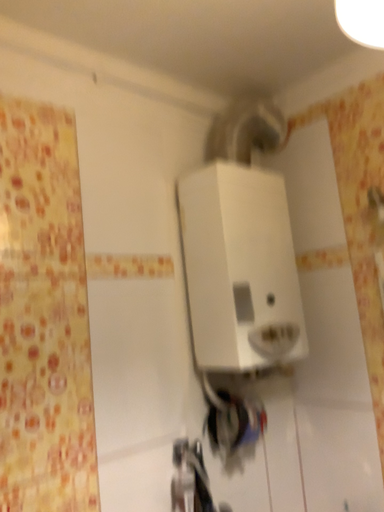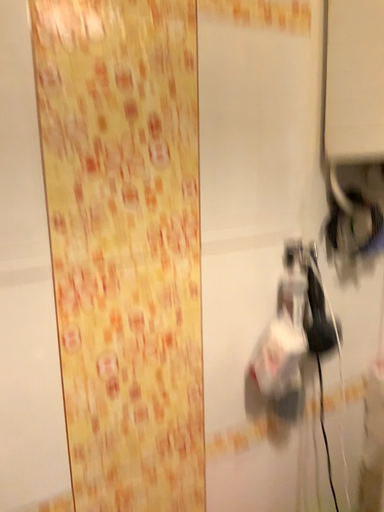
Question: Which way did the camera rotate in the video?

Choices:
 (A) rotated right
 (B) rotated left

Answer: (B)